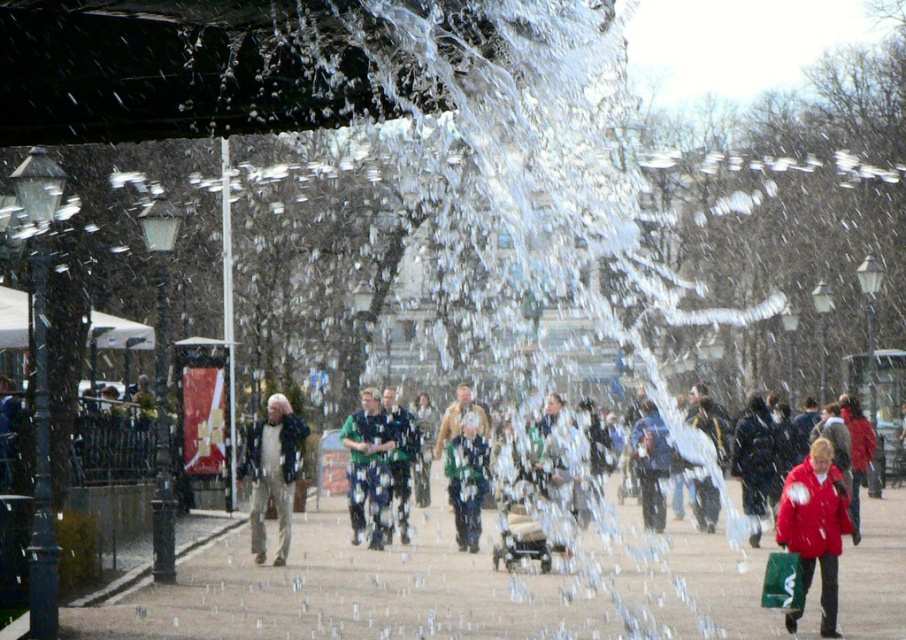
Question: Which object is closer to the camera taking this photo?

Choices:
 (A) green fabric jacket at center
 (B) clear water at center

Answer: (B)

Question: Which object appears farthest from the camera in this image?

Choices:
 (A) green fabric jacket at center
 (B) green knitted sweater at center
 (C) green textured scarf at center
 (D) matte red coat at lower right

Answer: (A)

Question: Can you confirm if matte red coat at lower right is smaller than light brown leather jacket at center?

Choices:
 (A) no
 (B) yes

Answer: (B)

Question: Among these objects, which one is farthest from the camera?

Choices:
 (A) green fabric jacket at center
 (B) green textured scarf at center
 (C) matte red coat at lower right

Answer: (A)

Question: Can you confirm if clear water at center is bigger than light brown leather jacket at center?

Choices:
 (A) no
 (B) yes

Answer: (B)

Question: Can you confirm if clear water at center is thinner than green knitted sweater at center?

Choices:
 (A) yes
 (B) no

Answer: (B)